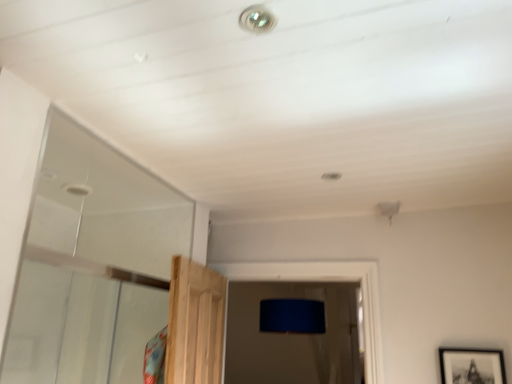
Describe the element at coordinates (472, 366) in the screenshot. I see `black matte picture frame at lower right` at that location.

In order to click on black matte picture frame at lower right in this screenshot , I will do point(472,366).

What are the coordinates of `metallic droplight at upper center` in the screenshot? It's located at (257, 19).

Describe the element at coordinates (257, 19) in the screenshot. The width and height of the screenshot is (512, 384). I see `metallic droplight at upper center` at that location.

At what (x,y) coordinates should I click in order to perform the action: click on black matte picture frame at lower right. Please return your answer as a coordinate pair (x, y). Looking at the image, I should click on (472, 366).

Considering the relative positions of metallic droplight at upper center and black matte picture frame at lower right in the image provided, is metallic droplight at upper center to the left or to the right of black matte picture frame at lower right?

Clearly, metallic droplight at upper center is on the left of black matte picture frame at lower right in the image.

Which object is more forward, metallic droplight at upper center or black matte picture frame at lower right?

Positioned in front is metallic droplight at upper center.

Considering the positions of points (262, 24) and (477, 376), is point (262, 24) closer to camera compared to point (477, 376)?

Yes.

From the image's perspective, who appears lower, metallic droplight at upper center or black matte picture frame at lower right?

black matte picture frame at lower right appears lower in the image.

From a real-world perspective, which is physically below, metallic droplight at upper center or black matte picture frame at lower right?

black matte picture frame at lower right is physically lower.

Which object is wider, metallic droplight at upper center or black matte picture frame at lower right?

Wider between the two is metallic droplight at upper center.

Who is shorter, metallic droplight at upper center or black matte picture frame at lower right?

metallic droplight at upper center.

Is metallic droplight at upper center bigger than black matte picture frame at lower right?

Incorrect, metallic droplight at upper center is not larger than black matte picture frame at lower right.

Is metallic droplight at upper center outside of black matte picture frame at lower right?

That's correct, metallic droplight at upper center is outside of black matte picture frame at lower right.

Is metallic droplight at upper center next to black matte picture frame at lower right and touching it?

No, metallic droplight at upper center is not touching black matte picture frame at lower right.

Is metallic droplight at upper center positioned with its back to black matte picture frame at lower right?

No, black matte picture frame at lower right is not at the back of metallic droplight at upper center.

Can you tell me how much metallic droplight at upper center and black matte picture frame at lower right differ in facing direction?

They differ by 180 degrees in their facing directions.

Measure the distance between metallic droplight at upper center and black matte picture frame at lower right.

metallic droplight at upper center is 1.76 meters away from black matte picture frame at lower right.

Locate an element on the screen. The image size is (512, 384). picture frame below the metallic droplight at upper center (from a real-world perspective) is located at coordinates (472, 366).

In the scene shown: Which object is positioned more to the right, black matte picture frame at lower right or metallic droplight at upper center?

From the viewer's perspective, black matte picture frame at lower right appears more on the right side.

Which object is closer to the camera taking this photo, black matte picture frame at lower right or metallic droplight at upper center?

metallic droplight at upper center is more forward.

Does point (500, 362) come behind point (267, 17)?

That is True.

From the image's perspective, which object appears higher, black matte picture frame at lower right or metallic droplight at upper center?

From the image's view, metallic droplight at upper center is above.

From a real-world perspective, between black matte picture frame at lower right and metallic droplight at upper center, who is vertically lower?

black matte picture frame at lower right is physically lower.

Between black matte picture frame at lower right and metallic droplight at upper center, which one has larger width?

metallic droplight at upper center is wider.

Does black matte picture frame at lower right have a lesser height compared to metallic droplight at upper center?

In fact, black matte picture frame at lower right may be taller than metallic droplight at upper center.

Considering the sizes of objects black matte picture frame at lower right and metallic droplight at upper center in the image provided, who is bigger, black matte picture frame at lower right or metallic droplight at upper center?

With larger size is black matte picture frame at lower right.

From the picture: Choose the correct answer: Is black matte picture frame at lower right inside metallic droplight at upper center or outside it?

The correct answer is: outside.

Would you say black matte picture frame at lower right is a long distance from metallic droplight at upper center?

Yes, black matte picture frame at lower right is far from metallic droplight at upper center.

Is black matte picture frame at lower right aimed at metallic droplight at upper center?

No.

What's the angular difference between black matte picture frame at lower right and metallic droplight at upper center's facing directions?

The facing directions of black matte picture frame at lower right and metallic droplight at upper center are 180 degrees apart.

The image size is (512, 384). Identify the location of droplight in front of the black matte picture frame at lower right. (257, 19).

Find the location of a particular element. picture frame that is below the metallic droplight at upper center (from the image's perspective) is located at coordinates (472, 366).

You are a GUI agent. You are given a task and a screenshot of the screen. Output one action in this format:
    pyautogui.click(x=<x>, y=<y>)
    Task: Click on the picture frame below the metallic droplight at upper center (from a real-world perspective)
    
    Given the screenshot: What is the action you would take?
    pyautogui.click(x=472, y=366)